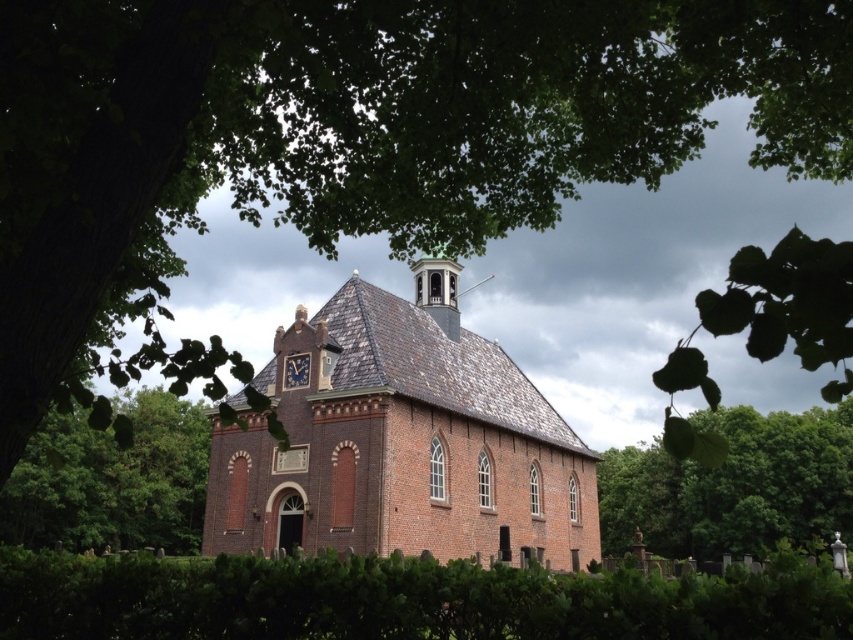
You are standing at the entrance of the traditional brick church and see a point marked at coordinates (403, 600). What object is located at that point?

The point at coordinates (403, 600) indicates the green leafy hedge at lower center.

You are standing in front of the church and notice two points marked on the ground. The first point is at coordinate point (36, 628) and the second is at point (38, 484). Which point is closer to you?

Point (36, 628) is closer to the viewer than point (38, 484).

You are standing in front of the church and want to take a photo of the green leafy tree at lower left. However, the green leafy hedge at lower center is blocking your view. Can you move to the right to get a clear shot?

The green leafy hedge at lower center is shorter than the green leafy tree at lower left, so moving to the right might allow you to see over the hedge and capture the tree in your photo.